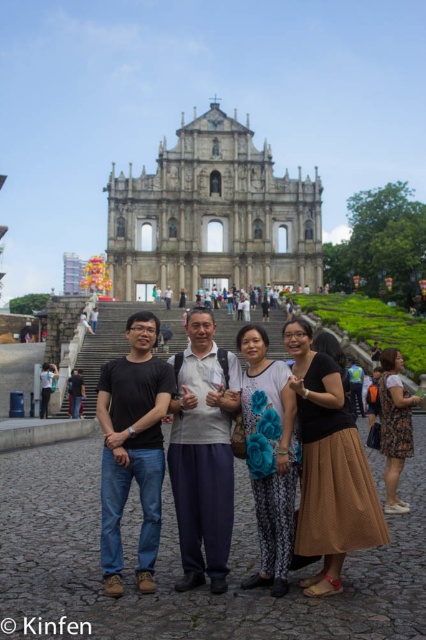
Question: Is white cotton shirt at center in front of black matte shirt at center?

Choices:
 (A) yes
 (B) no

Answer: (B)

Question: Which point is closer to the camera?

Choices:
 (A) (221, 563)
 (B) (129, 454)
 (C) (287, 470)
 (D) (281, 273)

Answer: (A)

Question: Which object appears farthest from the camera in this image?

Choices:
 (A) matte blue fabric purse at center
 (B) black fabric backpack at center

Answer: (B)

Question: Does brown textured skirt at center have a lesser width compared to black matte shirt at center?

Choices:
 (A) yes
 (B) no

Answer: (B)

Question: Which point is closer to the camera?

Choices:
 (A) floral-patterned dress at lower right
 (B) black fabric backpack at center

Answer: (A)

Question: Is black matte shirt at center below matte blue fabric purse at center?

Choices:
 (A) yes
 (B) no

Answer: (A)